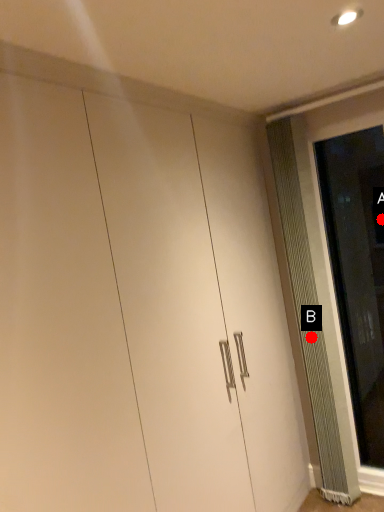
Question: Two points are circled on the image, labeled by A and B beside each circle. Which point is closer to the camera?

Choices:
 (A) A is closer
 (B) B is closer

Answer: (B)